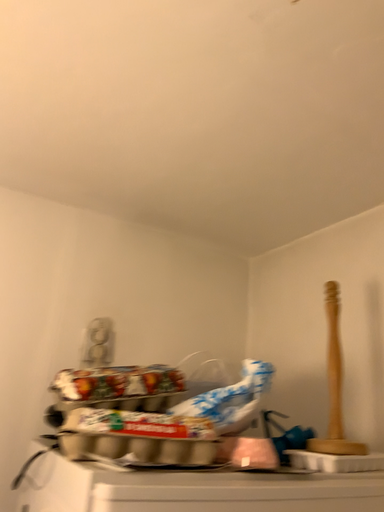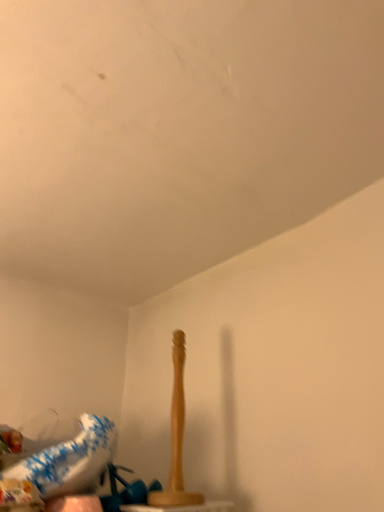
Question: Which way did the camera rotate in the video?

Choices:
 (A) rotated upward
 (B) rotated downward

Answer: (A)